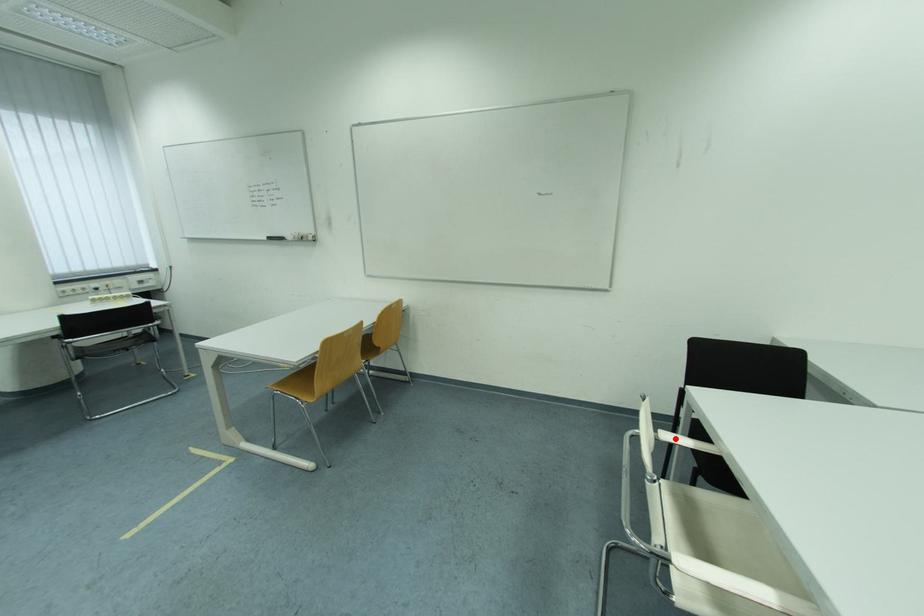
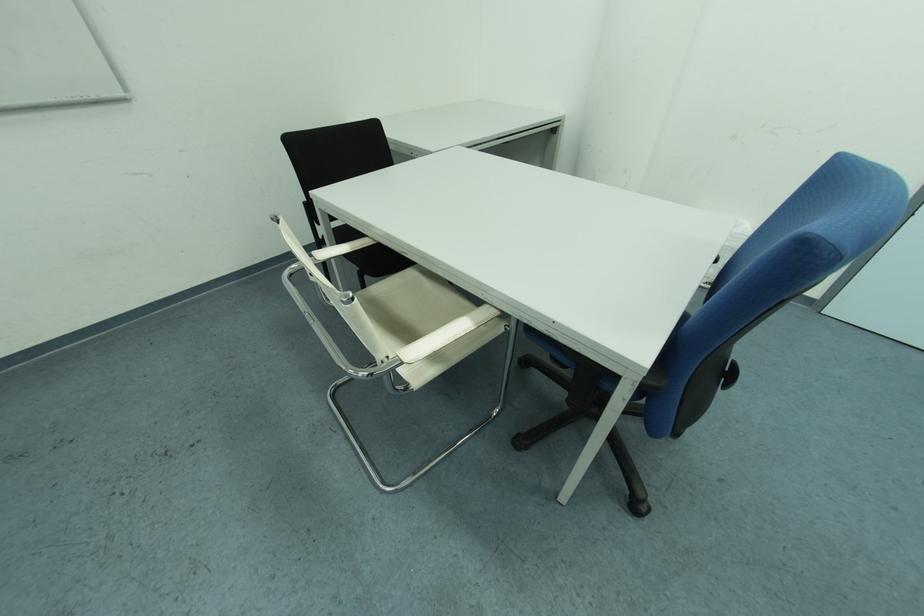
Question: I am providing you with two images of the same scene from different viewpoints. Given a red point in image1, look at the same physical point in image2. Is it:

Choices:
 (A) Closer to the viewpoint
 (B) Farther from the viewpoint

Answer: (A)